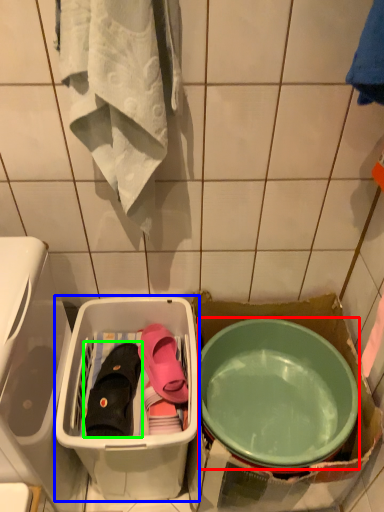
Question: Which object is the closest to the mixing bowl (highlighted by a red box)? Choose among these: storage box (highlighted by a blue box) or footwear (highlighted by a green box).

Choices:
 (A) storage box
 (B) footwear

Answer: (A)